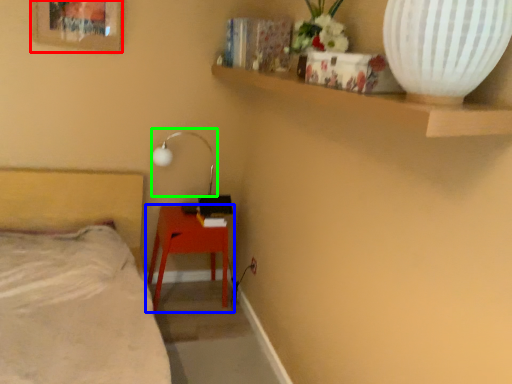
Question: Which is nearer to the picture frame (highlighted by a red box)? table (highlighted by a blue box) or lamp (highlighted by a green box).

Choices:
 (A) table
 (B) lamp

Answer: (B)